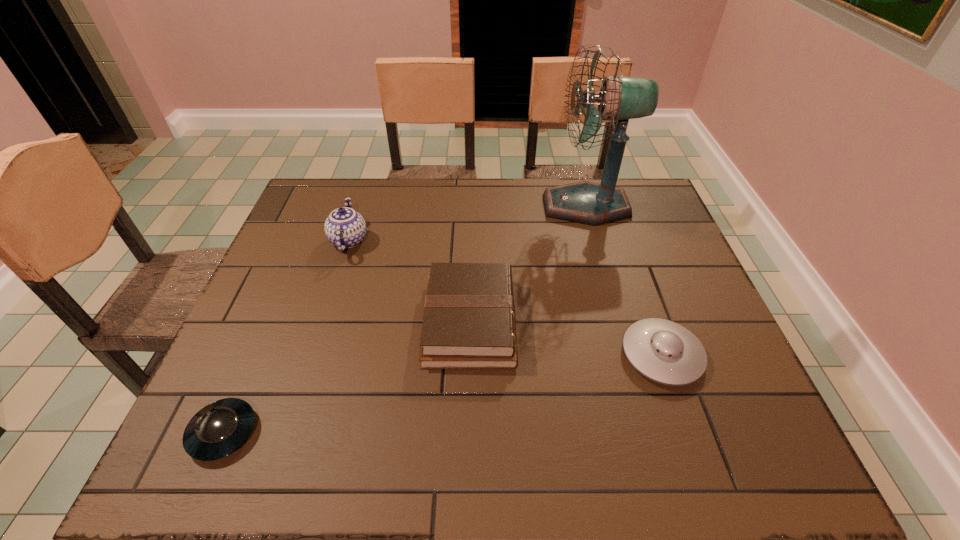
Where is `the tallest object`? the tallest object is located at coordinates (620, 98).

Locate an element on the screen. the fourth object from right to left is located at coordinates (345, 228).

I want to click on the second tallest object, so coord(345,228).

Locate an element on the screen. the third object from left to right is located at coordinates (469, 322).

Where is `Bible`? Bible is located at coordinates (469, 322).

Where is `the taller saucer`? This screenshot has height=540, width=960. the taller saucer is located at coordinates [x=663, y=351].

Identify the location of the fourth tallest object. Image resolution: width=960 pixels, height=540 pixels. (663, 351).

Where is `the leftmost object`? The image size is (960, 540). the leftmost object is located at coordinates (220, 428).

Find the location of a particular element. Image resolution: width=960 pixels, height=540 pixels. the shortest object is located at coordinates (220, 428).

Image resolution: width=960 pixels, height=540 pixels. Identify the location of vacant area situated 0.140m in front of the fan where the wind blows. (499, 206).